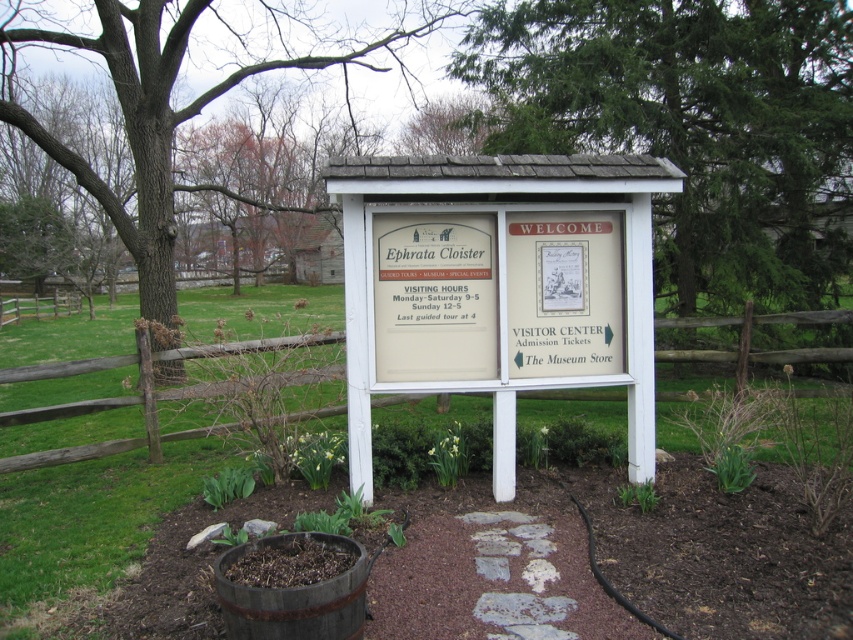
From the picture: You are a visitor at Ephrata Cloister and want to take a guided tour. You see a brown rough bark tree at upper left and a rustic wooden barrel at lower center. Which object is higher in the image?

The brown rough bark tree at upper left is located above rustic wooden barrel at lower center, so it is higher in the image.

In the scene shown: You are standing at point (349, 48) and want to walk to the signboard for Ephrata Cloister. If your walking speed is 1.2 meters per second, how many seconds will it take you to reach the signboard?

The distance between you and the signboard is 21.24 meters. At a speed of 1.2 meters per second, dividing the distance by speed gives 21.24 divided by 1.2 equals 17.7 seconds. So, it will take approximately 17.7 seconds to reach the signboard.